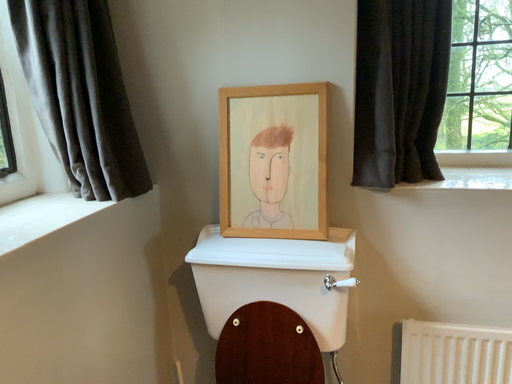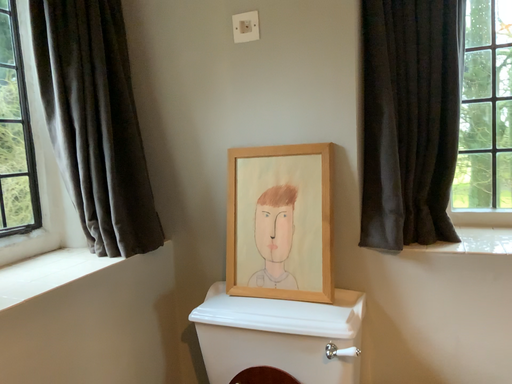
Question: How did the camera likely rotate when shooting the video?

Choices:
 (A) rotated downward
 (B) rotated upward

Answer: (B)